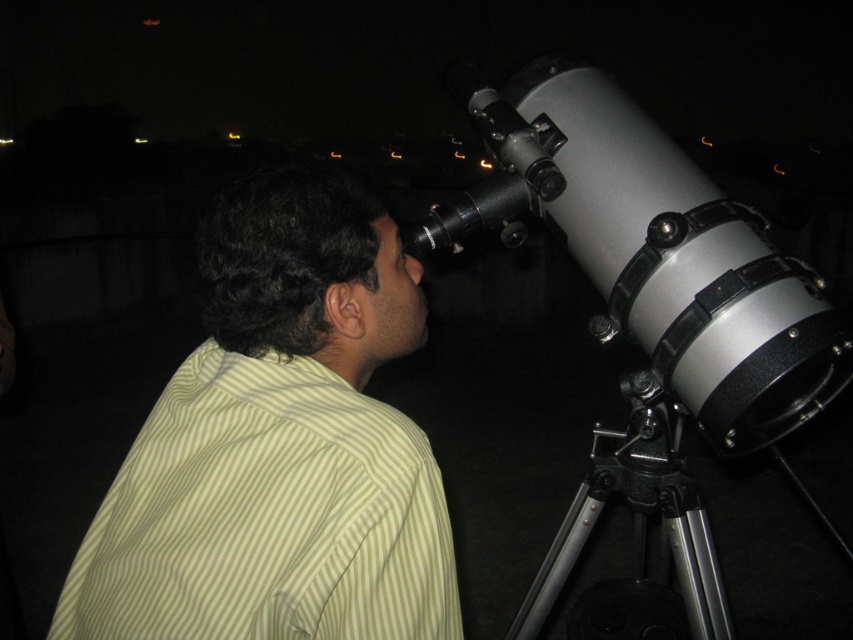
Can you confirm if light yellow striped shirt at center is positioned above silver metallic telescope at right?

Yes, light yellow striped shirt at center is above silver metallic telescope at right.

Does light yellow striped shirt at center have a greater height compared to silver metallic telescope at right?

In fact, light yellow striped shirt at center may be shorter than silver metallic telescope at right.

I want to click on light yellow striped shirt at center, so click(279, 444).

The height and width of the screenshot is (640, 853). In order to click on light yellow striped shirt at center in this screenshot , I will do `click(279, 444)`.